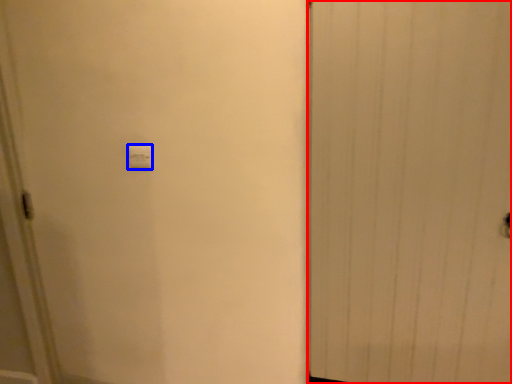
Question: Which point is further to the camera, door (highlighted by a red box) or light switch (highlighted by a blue box)?

Choices:
 (A) door
 (B) light switch

Answer: (B)